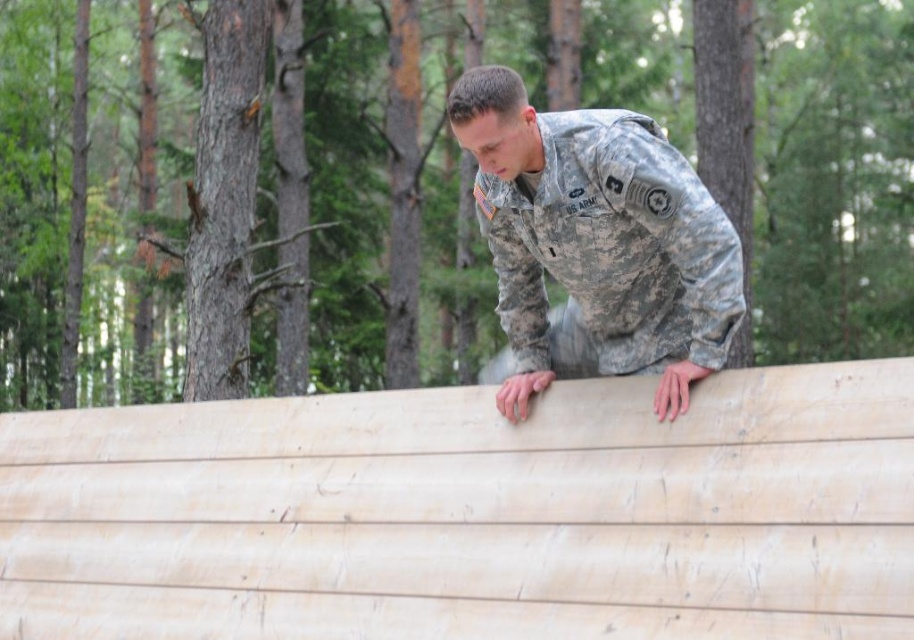
Question: Which object is farther from the camera taking this photo?

Choices:
 (A) camouflage fabric soldier at center
 (B) natural wood plywood at upper center

Answer: (A)

Question: Is natural wood plywood at upper center below camouflage fabric soldier at center?

Choices:
 (A) yes
 (B) no

Answer: (A)

Question: Which point is closer to the camera taking this photo?

Choices:
 (A) (108, 461)
 (B) (606, 202)

Answer: (B)

Question: Which of the following is the farthest from the observer?

Choices:
 (A) natural wood plywood at upper center
 (B) camouflage fabric soldier at center

Answer: (B)

Question: From the image, what is the correct spatial relationship of natural wood plywood at upper center in relation to camouflage fabric soldier at center?

Choices:
 (A) below
 (B) above

Answer: (A)

Question: Is natural wood plywood at upper center bigger than camouflage fabric soldier at center?

Choices:
 (A) no
 (B) yes

Answer: (B)